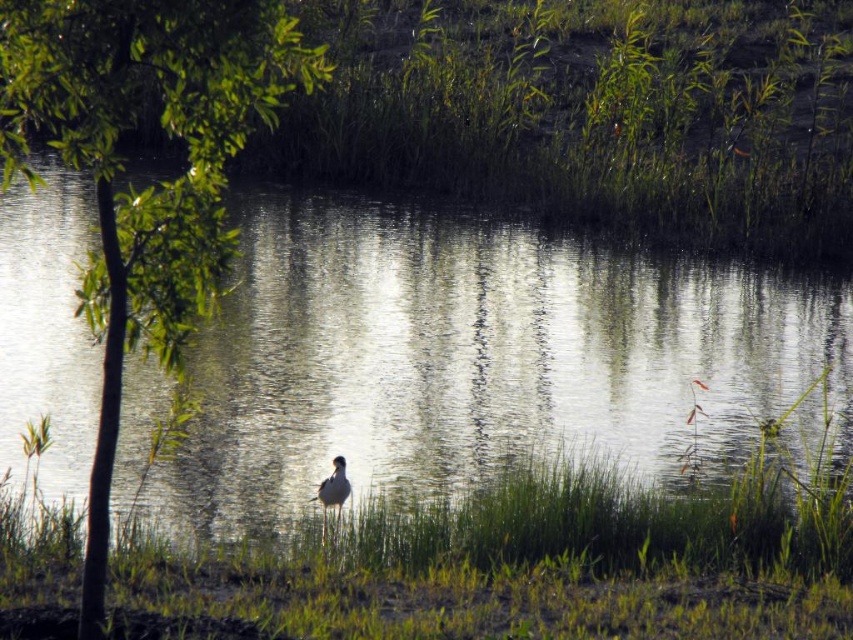
Between green leafy tree at center and white feathered bird at center, which one is positioned lower?

white feathered bird at center is below.

Does green leafy tree at center have a lesser height compared to white feathered bird at center?

No, green leafy tree at center is not shorter than white feathered bird at center.

Is point (96, 592) closer to viewer compared to point (335, 460)?

Yes, point (96, 592) is closer to viewer.

Identify the location of green leafy tree at center. Image resolution: width=853 pixels, height=640 pixels. (149, 188).

Does clear water at center have a lesser height compared to green leafy tree at center?

Yes, clear water at center is shorter than green leafy tree at center.

Is point (358, 378) closer to viewer compared to point (183, 24)?

No, it is behind (183, 24).

Find the location of a particular element. clear water at center is located at coordinates (474, 358).

Can you confirm if clear water at center is smaller than green grass at center?

Incorrect, clear water at center is not smaller in size than green grass at center.

Is clear water at center in front of green grass at center?

No, it is behind green grass at center.

In the scene shown: Measure the distance between clear water at center and camera.

clear water at center and camera are 10.71 meters apart.

Where is `clear water at center`? Image resolution: width=853 pixels, height=640 pixels. clear water at center is located at coordinates (474, 358).